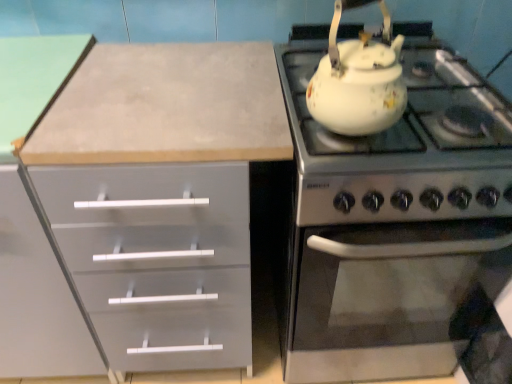
Question: Is white glossy teapot at upper right not inside white glossy kettle at upper right?

Choices:
 (A) yes
 (B) no

Answer: (A)

Question: From the image's perspective, is white glossy teapot at upper right beneath white glossy kettle at upper right?

Choices:
 (A) yes
 (B) no

Answer: (B)

Question: From a real-world perspective, is white glossy teapot at upper right on top of white glossy kettle at upper right?

Choices:
 (A) no
 (B) yes

Answer: (B)

Question: Considering the relative sizes of white glossy teapot at upper right and white glossy kettle at upper right in the image provided, is white glossy teapot at upper right smaller than white glossy kettle at upper right?

Choices:
 (A) no
 (B) yes

Answer: (B)

Question: Considering the relative sizes of white glossy teapot at upper right and white glossy kettle at upper right in the image provided, is white glossy teapot at upper right bigger than white glossy kettle at upper right?

Choices:
 (A) no
 (B) yes

Answer: (A)

Question: Is white glossy teapot at upper right oriented towards white glossy kettle at upper right?

Choices:
 (A) no
 (B) yes

Answer: (A)

Question: Is white glossy kettle at upper right positioned far away from white glossy teapot at upper right?

Choices:
 (A) no
 (B) yes

Answer: (A)

Question: Is white glossy kettle at upper right smaller than white glossy teapot at upper right?

Choices:
 (A) yes
 (B) no

Answer: (B)

Question: Is white glossy teapot at upper right at the back of white glossy kettle at upper right?

Choices:
 (A) yes
 (B) no

Answer: (B)

Question: Does white glossy kettle at upper right lie in front of white glossy teapot at upper right?

Choices:
 (A) yes
 (B) no

Answer: (B)

Question: Can you confirm if white glossy kettle at upper right is positioned to the right of white glossy teapot at upper right?

Choices:
 (A) no
 (B) yes

Answer: (B)

Question: Are white glossy kettle at upper right and white glossy teapot at upper right beside each other?

Choices:
 (A) no
 (B) yes

Answer: (A)

Question: Considering the relative positions of white glossy kettle at upper right and white glossy teapot at upper right in the image provided, is white glossy kettle at upper right to the left or to the right of white glossy teapot at upper right?

Choices:
 (A) right
 (B) left

Answer: (A)